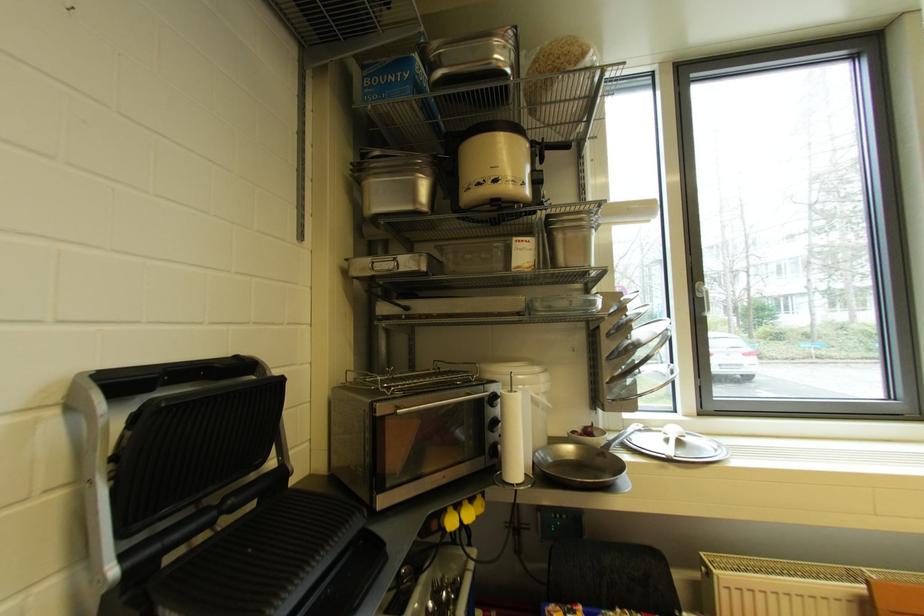
What are the coordinates of `metal container handle` in the screenshot? It's located at (382, 259).